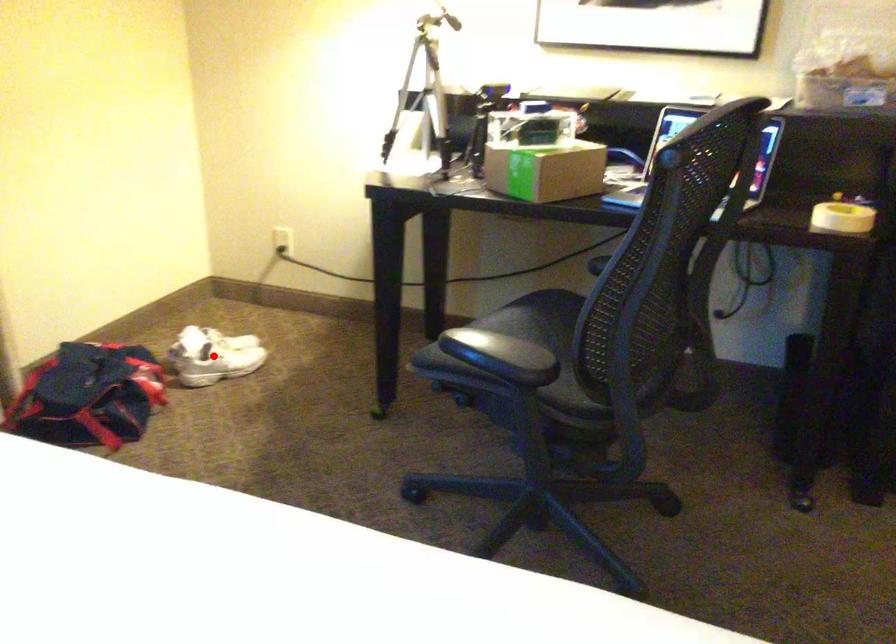
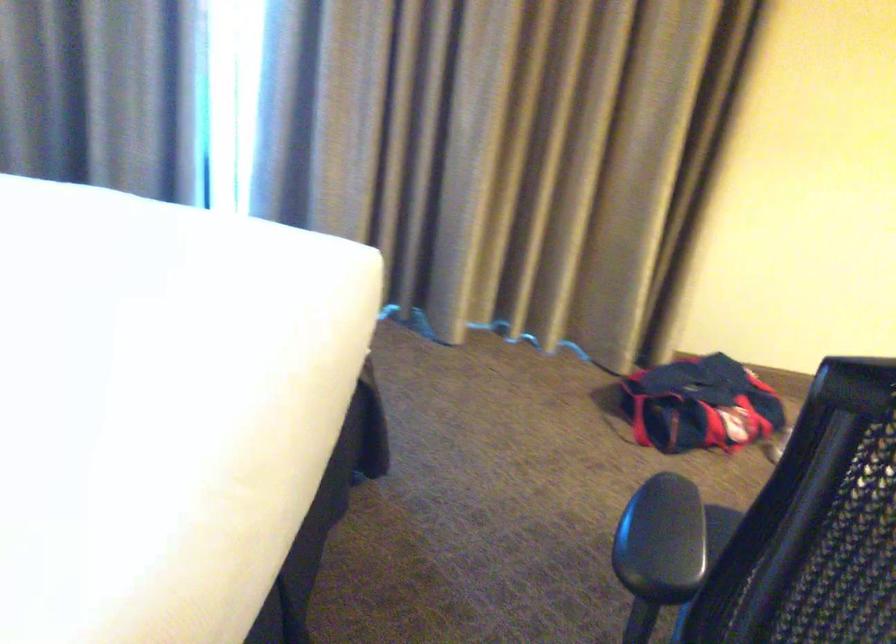
Question: I am providing you with two images of the same scene from different viewpoints. A red point is marked on the first image. At the location where the point appears in image 1, is it still visible in image 2?

Choices:
 (A) Yes
 (B) No

Answer: (B)